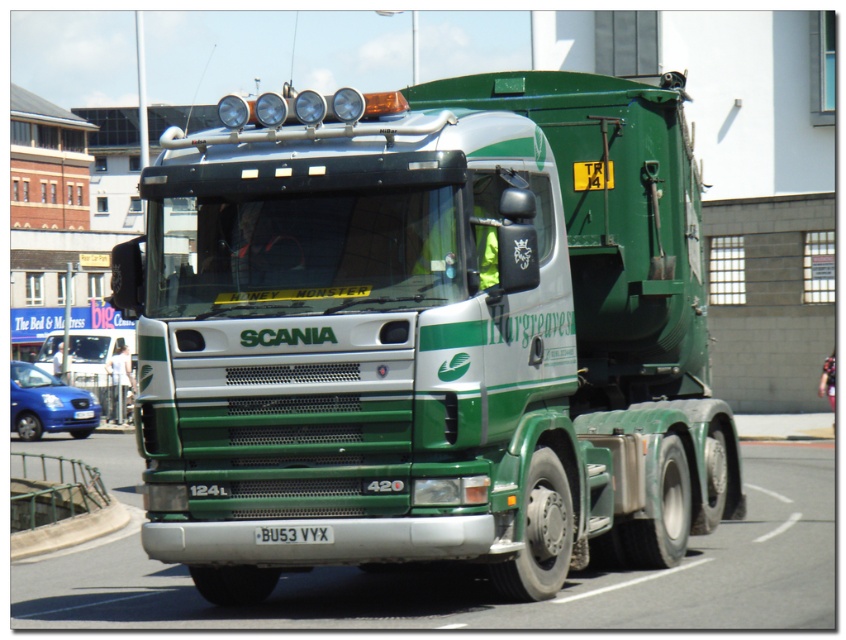
You are a photographer trying to capture the Scania truck in the image. You notice two points marked on the truck. Which point is closer to your camera lens? The points are located at coordinates point [279,509] and point [257,531].

Point [257,531] is closer to the camera lens because it is less further than point [279,509] according to the description.

You are a delivery driver who needs to park your car next to the green matte truck at center and the black plastic license plate at center. Which one should you park closer to if you want to avoid blocking the license plate?

You should park closer to the green matte truck at center because it is wider than the black plastic license plate at center, so the license plate is smaller and less likely to be blocked by your car.

You are a traffic officer observing a road scene. You notice a green matte truck at center and a black plastic license plate at center. Which object is bigger?

The green matte truck at center is larger in size than the black plastic license plate at center.